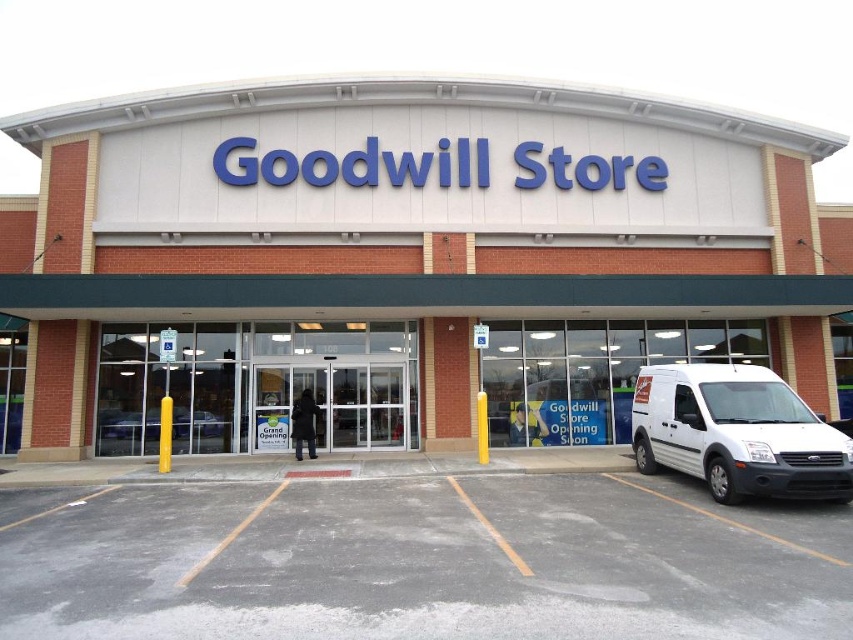
You are a customer arriving at the Goodwill Store and need to park your car. You see a white matte van at lower right and a silver metallic sedan at center. Which parking spot is closer to the entrance?

The silver metallic sedan at center is closer to the entrance because the white matte van at lower right is to the right of it, meaning the sedan is positioned between the entrance and the van.

You are standing at the Goodwill Store entrance and want to park your car. The parking lot has a point marked at coordinates [421,561]. Where is this point located?

The point marked at coordinates [421,561] is located on the gray asphalt parking lot at center.